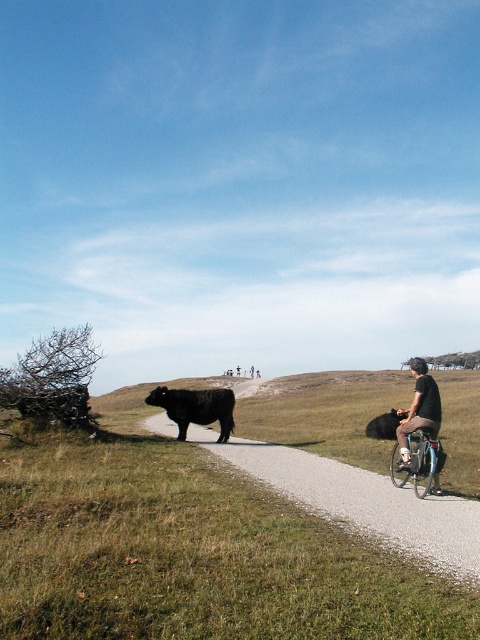
Question: Which of these objects is positioned closest to the black asphalt path at center?

Choices:
 (A) black fur cow at center
 (B) silver metallic bicycle at center-right
 (C) dark brown leather jacket at right
 (D) green grass at center

Answer: (B)

Question: Which object is closer to the camera taking this photo?

Choices:
 (A) dark brown leather jacket at right
 (B) green grass at center
 (C) black matte bull at center
 (D) silver metallic bicycle at center-right

Answer: (B)

Question: Which object appears closest to the camera in this image?

Choices:
 (A) black fur cow at center
 (B) dark brown leather jacket at right
 (C) silver metallic bicycle at center-right

Answer: (C)

Question: Can you confirm if black asphalt path at center is wider than silver metallic bicycle at center-right?

Choices:
 (A) no
 (B) yes

Answer: (B)

Question: Does green grass at center have a lesser width compared to silver metallic bicycle at center-right?

Choices:
 (A) no
 (B) yes

Answer: (A)

Question: Is green grass at center to the left of black asphalt path at center from the viewer's perspective?

Choices:
 (A) yes
 (B) no

Answer: (A)